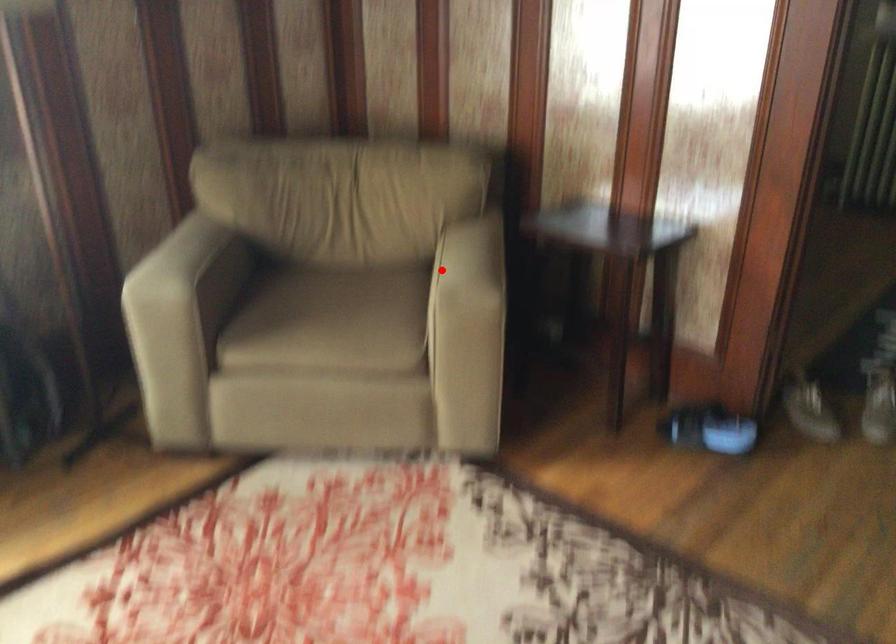
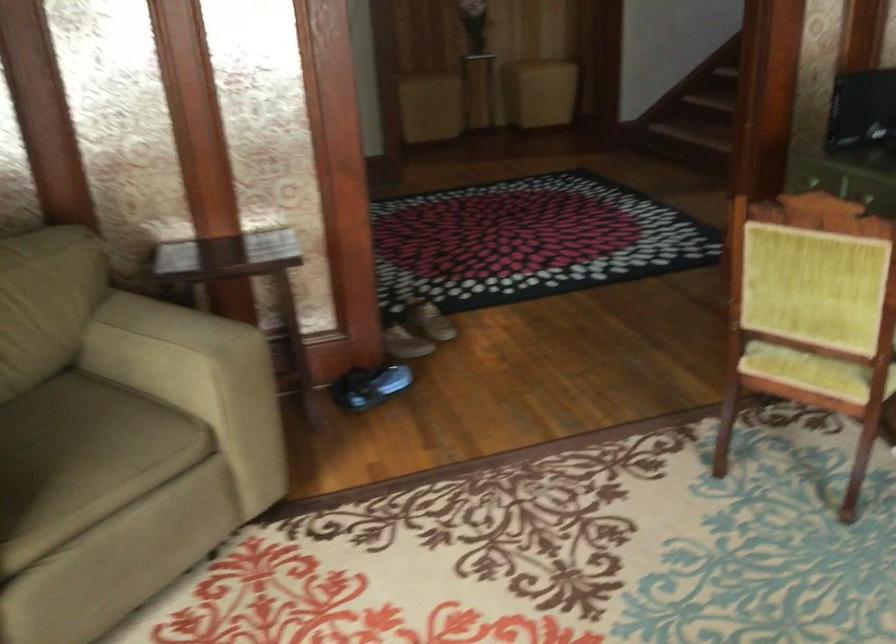
Where in the second image is the point corresponding to the highlighted location from the first image?

(153, 345)